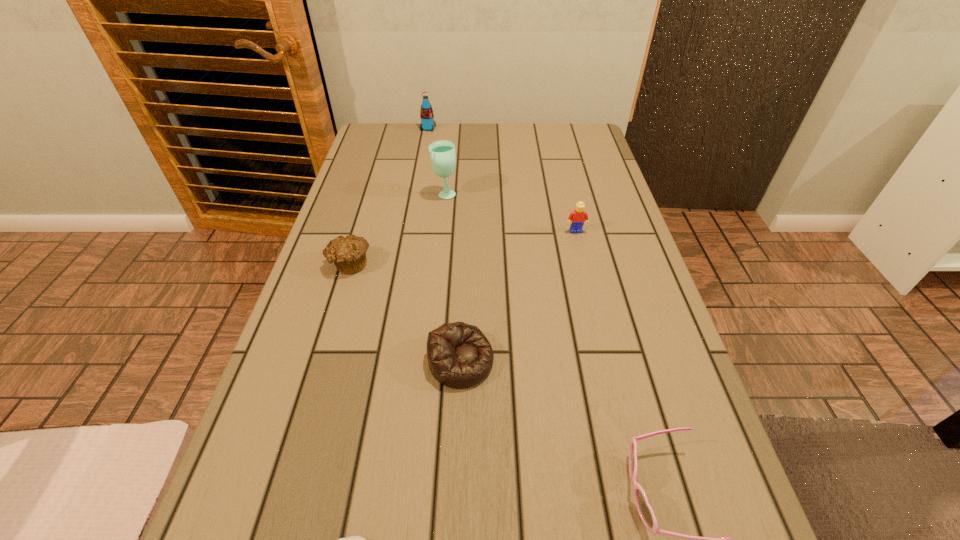
Locate an element on the screen. free space located on the front of the farthest object is located at coordinates (419, 181).

Identify the location of free space located 0.320m on the front-facing side of the fifth nearest object. This screenshot has height=540, width=960. (601, 335).

You are a GUI agent. You are given a task and a screenshot of the screen. Output one action in this format:
    pyautogui.click(x=<x>, y=<y>)
    Task: Click on the vacant space located on the front of the muffin
    
    Given the screenshot: What is the action you would take?
    pyautogui.click(x=311, y=388)

What are the coordinates of `free space located on the left of the beanbag` in the screenshot? It's located at (360, 361).

Where is `object that is at the far edge`? object that is at the far edge is located at coordinates (426, 113).

Locate an element on the screen. object at the left edge is located at coordinates pos(348,253).

I want to click on object present at the right edge, so click(x=577, y=218).

In the image, there is a desktop. Identify the location of vacant space at the far edge. (516, 147).

I want to click on vacant space at the left edge of the desktop, so click(x=362, y=164).

Where is `vacant area at the right edge`? vacant area at the right edge is located at coordinates (596, 258).